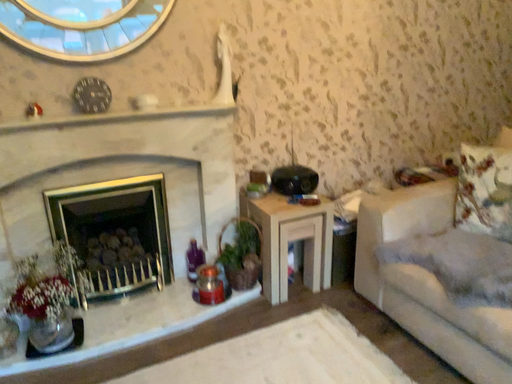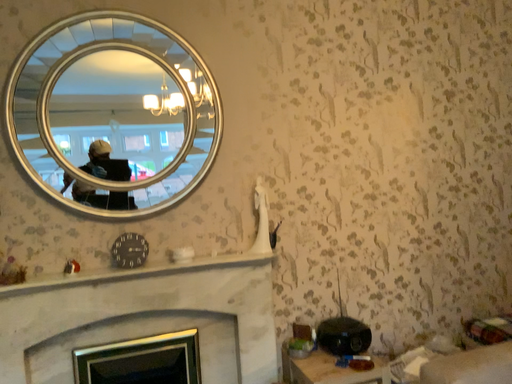
Question: How did the camera likely rotate when shooting the video?

Choices:
 (A) rotated right
 (B) rotated left

Answer: (B)